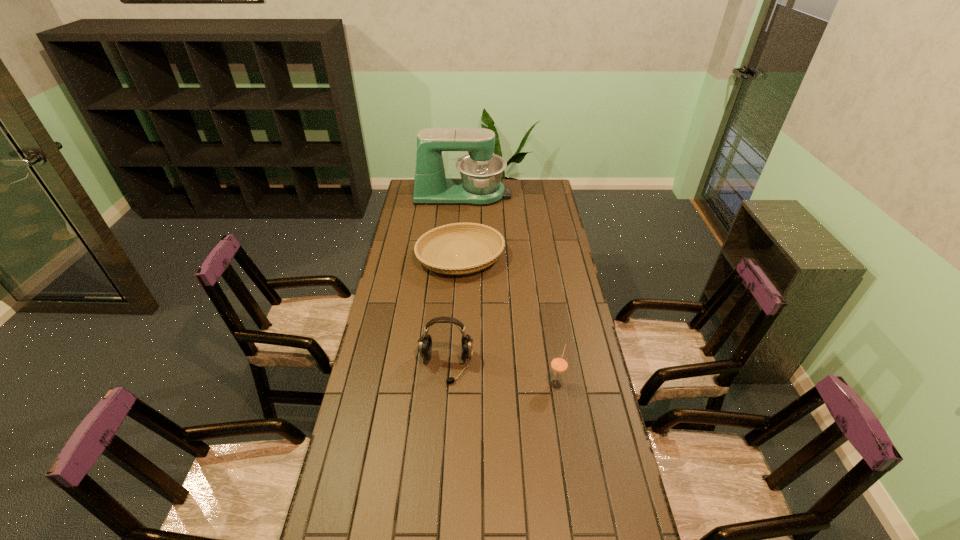
At what (x,y) coordinates should I click in order to perform the action: click on vacant space that satisfies the following two spatial constraints: 1. on the front-facing side of the farthest object; 2. with the microphone on the side of the headset. Please return your answer as a coordinate pair (x, y). Looking at the image, I should click on (453, 366).

Identify the location of blank area in the image that satisfies the following two spatial constraints: 1. on the front-facing side of the straw; 2. on the right side of the tallest object. (452, 383).

Identify the location of vacant region that satisfies the following two spatial constraints: 1. on the front-facing side of the tallest object; 2. on the left side of the straw. (452, 383).

I want to click on free space that satisfies the following two spatial constraints: 1. on the front-facing side of the farthest object; 2. on the back side of the shortest object, so click(459, 258).

This screenshot has height=540, width=960. What are the coordinates of `vacant space that satisfies the following two spatial constraints: 1. on the back side of the shortest object; 2. on the front-facing side of the tallest object` in the screenshot? It's located at (464, 194).

Find the location of a particular element. vacant space that satisfies the following two spatial constraints: 1. on the front side of the rightmost object; 2. on the left side of the shortest object is located at coordinates (454, 383).

Find the location of a particular element. vacant space that satisfies the following two spatial constraints: 1. on the front-facing side of the mixer; 2. on the left side of the basket is located at coordinates (459, 258).

Image resolution: width=960 pixels, height=540 pixels. I want to click on free space that satisfies the following two spatial constraints: 1. on the front side of the third tallest object; 2. on the right side of the third nearest object, so click(x=454, y=383).